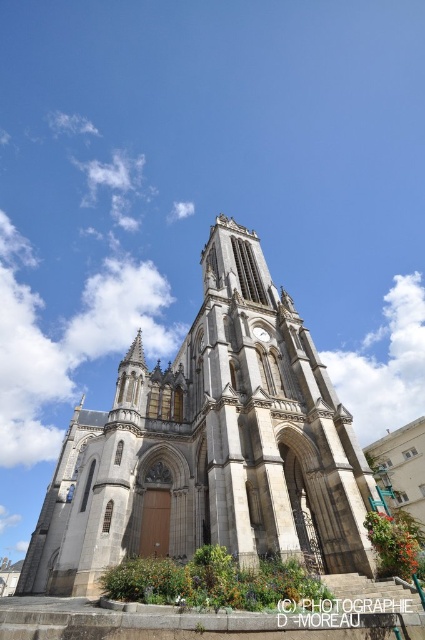
Question: Considering the relative positions of light gray stone church at center and white stone clock at center in the image provided, where is light gray stone church at center located with respect to white stone clock at center?

Choices:
 (A) left
 (B) right

Answer: (A)

Question: Which of the following is the closest to the observer?

Choices:
 (A) light gray stone church at center
 (B) white stone clock at center

Answer: (A)

Question: Which object is farther from the camera taking this photo?

Choices:
 (A) light gray stone church at center
 (B) white stone clock at center

Answer: (B)

Question: Is light gray stone church at center to the right of white stone clock at center from the viewer's perspective?

Choices:
 (A) yes
 (B) no

Answer: (B)

Question: Which object appears closest to the camera in this image?

Choices:
 (A) white stone clock at center
 (B) light gray stone church at center

Answer: (B)

Question: In this image, where is light gray stone church at center located relative to white stone clock at center?

Choices:
 (A) above
 (B) below

Answer: (B)